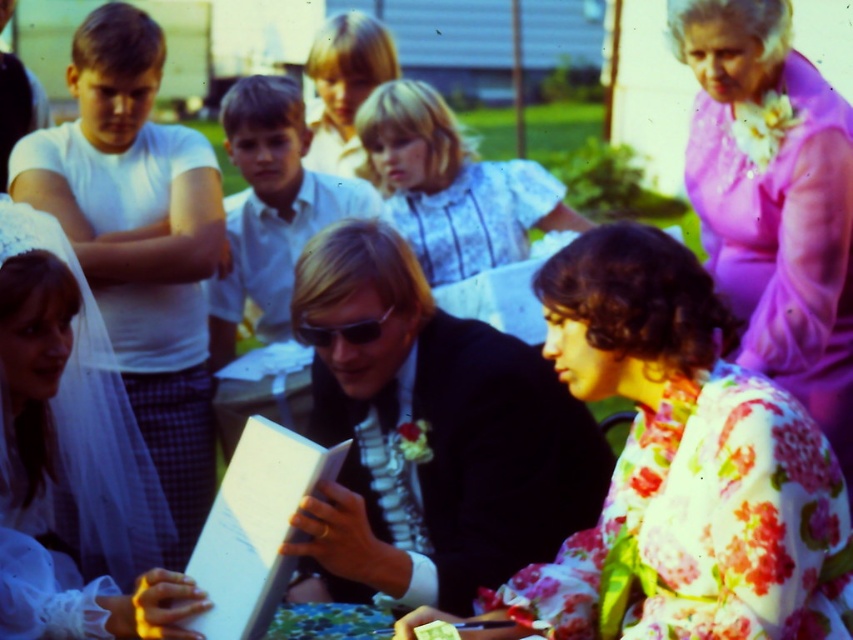
Is white satin veil at lower left thinner than white lace blouse at center?

Correct, white satin veil at lower left's width is less than white lace blouse at center's.

Which is behind, point (68, 301) or point (485, 227)?

Positioned behind is point (485, 227).

The height and width of the screenshot is (640, 853). Identify the location of white satin veil at lower left. (73, 460).

Can you confirm if floral silk blouse at center is positioned above purple satin dress at upper right?

No, floral silk blouse at center is not above purple satin dress at upper right.

Which is more to the right, floral silk blouse at center or purple satin dress at upper right?

Positioned to the right is purple satin dress at upper right.

Find the location of a particular element. This screenshot has height=640, width=853. floral silk blouse at center is located at coordinates (682, 467).

Is white satin veil at lower left smaller than blonde hair at upper center?

Correct, white satin veil at lower left occupies less space than blonde hair at upper center.

How much distance is there between white satin veil at lower left and blonde hair at upper center?

7.40 feet

Does point (76, 368) lie behind point (329, 58)?

That is False.

Find the location of a particular element. white satin veil at lower left is located at coordinates (73, 460).